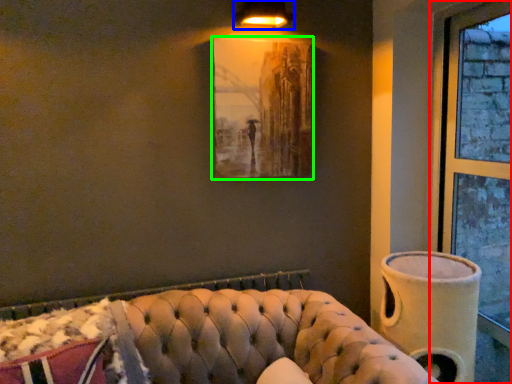
Question: Which is farther away from window (highlighted by a red box)? lamp (highlighted by a blue box) or picture frame (highlighted by a green box)?

Choices:
 (A) lamp
 (B) picture frame

Answer: (A)